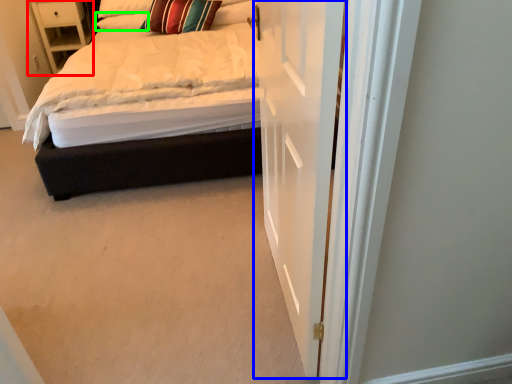
Question: Estimate the real-world distances between objects in this image. Which object is closer to nightstand (highlighted by a red box), door (highlighted by a blue box) or pillow (highlighted by a green box)?

Choices:
 (A) door
 (B) pillow

Answer: (B)